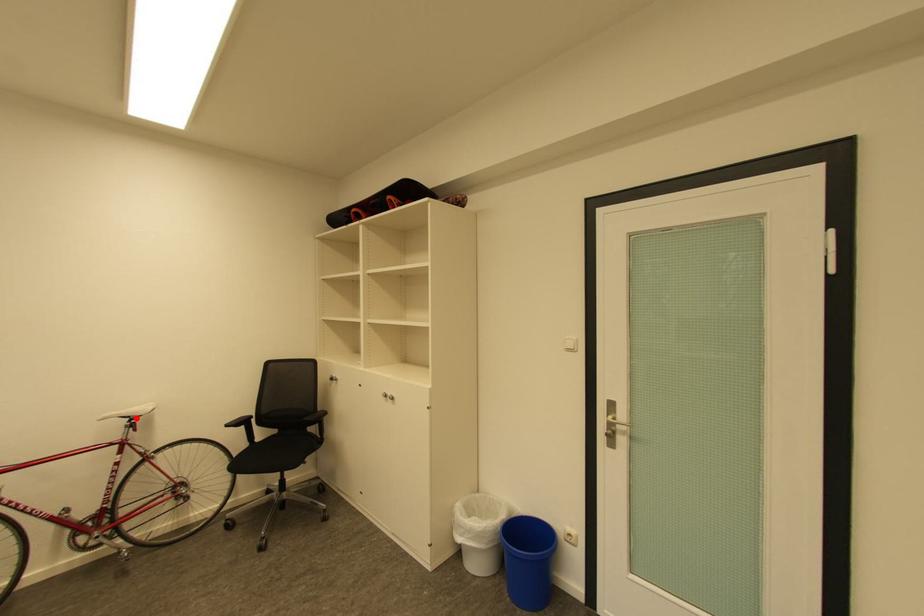
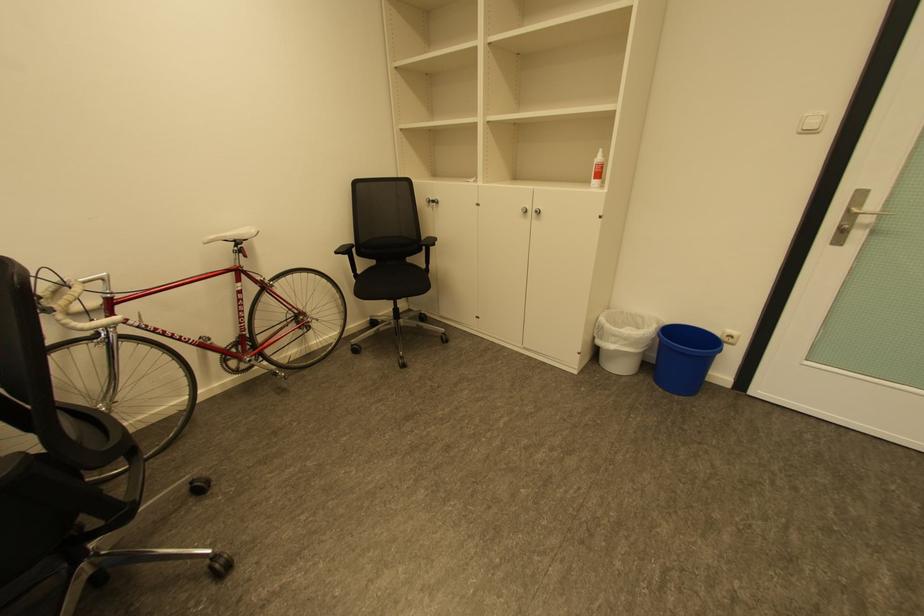
In the second image, find the point that corresponds to the highlighted location in the first image.

(241, 241)